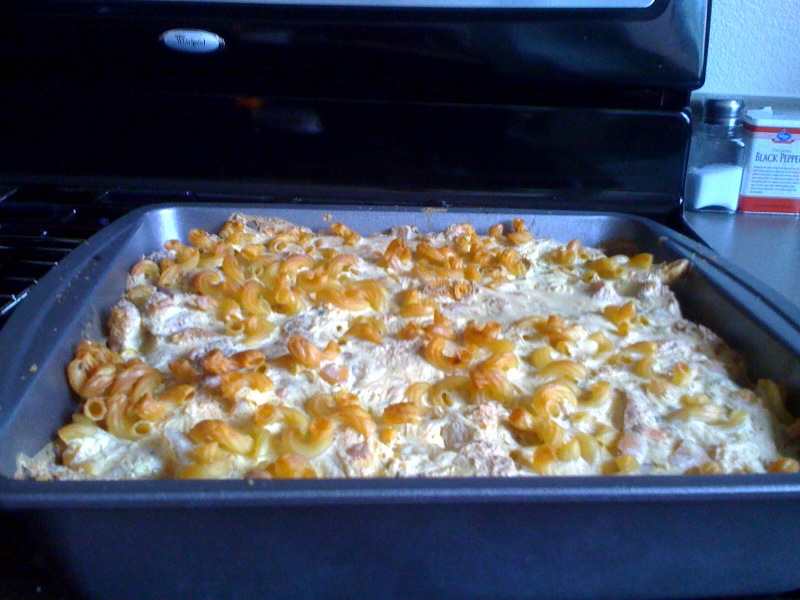
Identify the location of back splash tile. This screenshot has height=600, width=800. coord(753,100), coord(790,104).